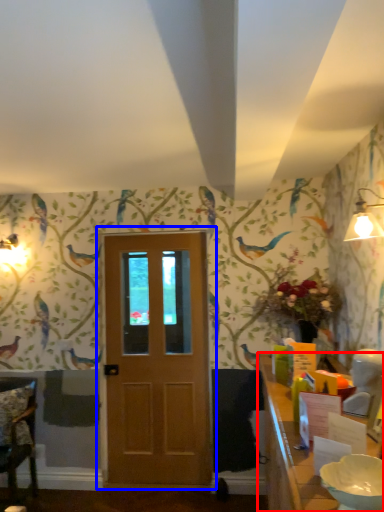
Question: Which object appears farthest to the camera in this image, table (highlighted by a red box) or door (highlighted by a blue box)?

Choices:
 (A) table
 (B) door

Answer: (B)